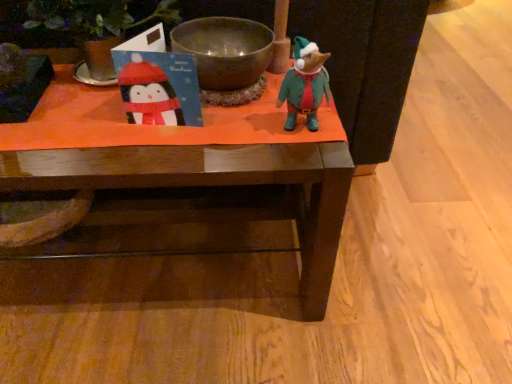
Question: Does shiny metallic bowl at center appear on the left side of wooden table at center?

Choices:
 (A) no
 (B) yes

Answer: (A)

Question: Is shiny metallic bowl at center positioned beyond the bounds of wooden table at center?

Choices:
 (A) yes
 (B) no

Answer: (A)

Question: Is shiny metallic bowl at center not near wooden table at center?

Choices:
 (A) no
 (B) yes

Answer: (A)

Question: Is shiny metallic bowl at center oriented away from wooden table at center?

Choices:
 (A) no
 (B) yes

Answer: (A)

Question: Does shiny metallic bowl at center lie behind wooden table at center?

Choices:
 (A) yes
 (B) no

Answer: (A)

Question: Is shiny metallic bowl at center bigger than wooden table at center?

Choices:
 (A) yes
 (B) no

Answer: (B)

Question: Is wooden table at center not within shiny metallic bowl at center?

Choices:
 (A) no
 (B) yes

Answer: (B)

Question: Is wooden table at center behind shiny metallic bowl at center?

Choices:
 (A) yes
 (B) no

Answer: (B)

Question: Is wooden table at center shorter than shiny metallic bowl at center?

Choices:
 (A) no
 (B) yes

Answer: (A)

Question: Is wooden table at center looking in the opposite direction of shiny metallic bowl at center?

Choices:
 (A) no
 (B) yes

Answer: (A)

Question: Is wooden table at center facing towards shiny metallic bowl at center?

Choices:
 (A) no
 (B) yes

Answer: (A)

Question: From a real-world perspective, does wooden table at center sit lower than shiny metallic bowl at center?

Choices:
 (A) no
 (B) yes

Answer: (B)

Question: Is shiny metallic bowl at center located outside green felt mouse at center?

Choices:
 (A) yes
 (B) no

Answer: (A)